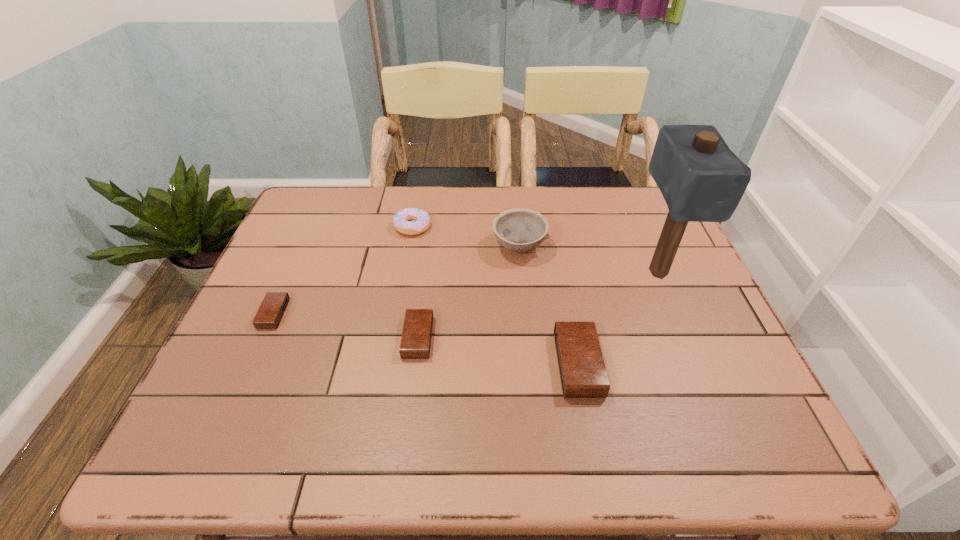
Find the location of a particular element. vacant region between the rightmost object and the shortest alarm clock is located at coordinates (466, 293).

Where is `vacant point located between the doughnut and the bowl`? The image size is (960, 540). vacant point located between the doughnut and the bowl is located at coordinates (466, 237).

This screenshot has height=540, width=960. I want to click on the fourth closest object relative to the second alarm clock from right to left, so click(272, 308).

Point out which object is positioned as the second nearest to the rightmost object. Please provide its 2D coordinates. Your answer should be formatted as a tuple, i.e. [(x, y)], where the tuple contains the x and y coordinates of a point satisfying the conditions above.

[(520, 230)]

At what (x,y) coordinates should I click in order to perform the action: click on alarm clock that is the nearest to the second tallest alarm clock. Please return your answer as a coordinate pair (x, y). This screenshot has height=540, width=960. Looking at the image, I should click on point(583,374).

Locate which alarm clock ranks in proximity to the bowl. Please provide its 2D coordinates. Your answer should be formatted as a tuple, i.e. [(x, y)], where the tuple contains the x and y coordinates of a point satisfying the conditions above.

[(583, 374)]